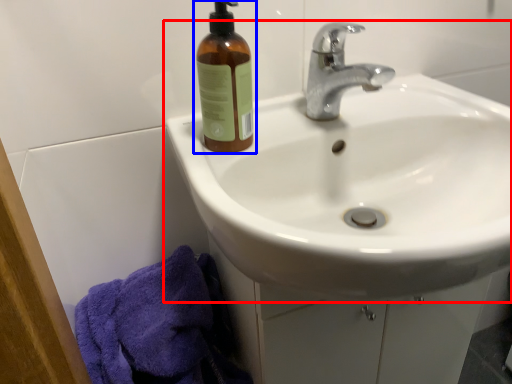
Question: Among these objects, which one is nearest to the camera, sink (highlighted by a red box) or bottle (highlighted by a blue box)?

Choices:
 (A) sink
 (B) bottle

Answer: (A)